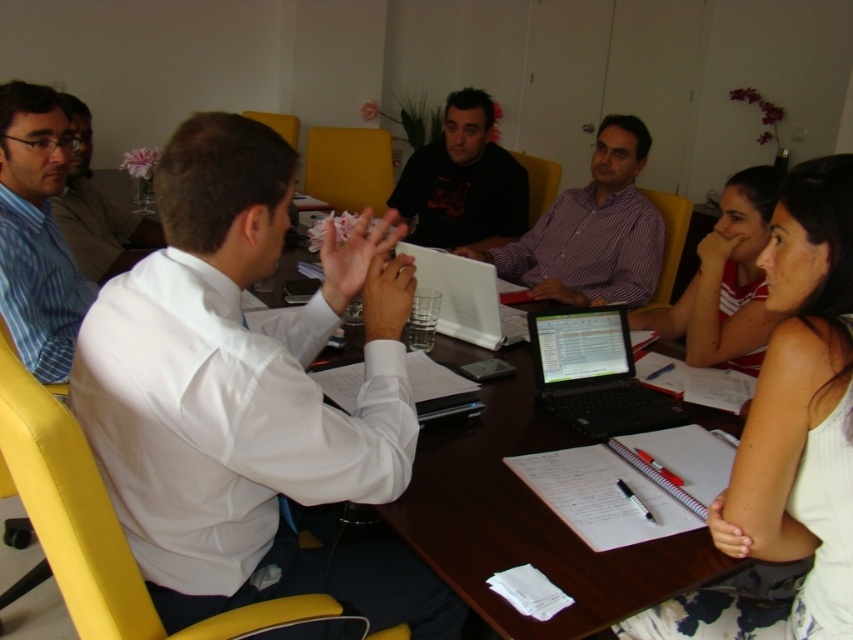
Question: Is striped cotton shirt at center closer to the viewer compared to black glossy laptop at center?

Choices:
 (A) no
 (B) yes

Answer: (A)

Question: Does white shirt at center have a greater width compared to matte black shirt at left?

Choices:
 (A) no
 (B) yes

Answer: (B)

Question: Which point is closer to the camera?

Choices:
 (A) (103, 234)
 (B) (47, 326)
 (C) (815, 304)
 (D) (677, 588)

Answer: (C)

Question: Which of the following is the farthest from the observer?

Choices:
 (A) brown wooden table at center
 (B) white matte laptop at center
 (C) matte black shirt at left

Answer: (C)

Question: Is matte black shirt at left wider than white matte laptop at center?

Choices:
 (A) yes
 (B) no

Answer: (B)

Question: Which is farther from the blue striped shirt at left?

Choices:
 (A) white matte laptop at center
 (B) white fabric shirt at upper right

Answer: (B)